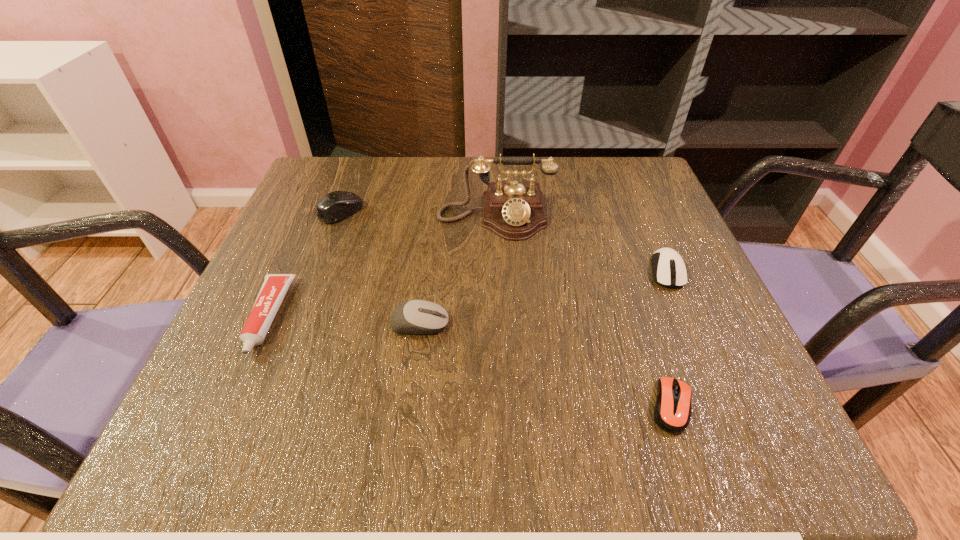
I want to click on telephone, so click(514, 210).

The width and height of the screenshot is (960, 540). What are the coordinates of `the leftmost computer mouse` in the screenshot? It's located at (335, 206).

In order to click on the third farthest computer mouse in this screenshot , I will do `click(417, 316)`.

Where is `the rightmost computer mouse`? the rightmost computer mouse is located at coordinates (669, 270).

The height and width of the screenshot is (540, 960). What are the coordinates of `the third nearest computer mouse` in the screenshot? It's located at (669, 270).

Find the location of a particular element. toothpaste is located at coordinates (274, 287).

Identify the location of the shortest computer mouse. This screenshot has height=540, width=960. pos(672,413).

I want to click on the third computer mouse from left to right, so click(x=672, y=413).

Find the location of a particular element. This screenshot has width=960, height=540. free space located on the dial of the telephone is located at coordinates (498, 290).

Where is `vacant space located 0.330m on the right of the leftmost computer mouse`? The width and height of the screenshot is (960, 540). vacant space located 0.330m on the right of the leftmost computer mouse is located at coordinates (510, 212).